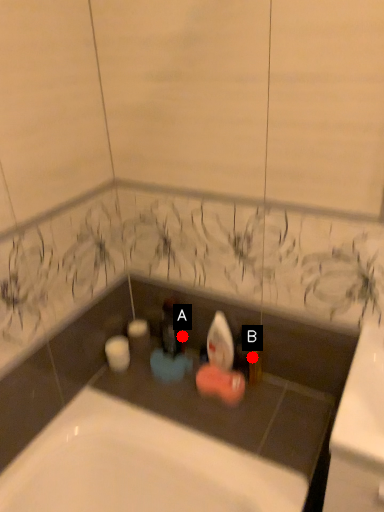
Question: Two points are circled on the image, labeled by A and B beside each circle. Among these points, which one is nearest to the camera?

Choices:
 (A) A is closer
 (B) B is closer

Answer: (B)